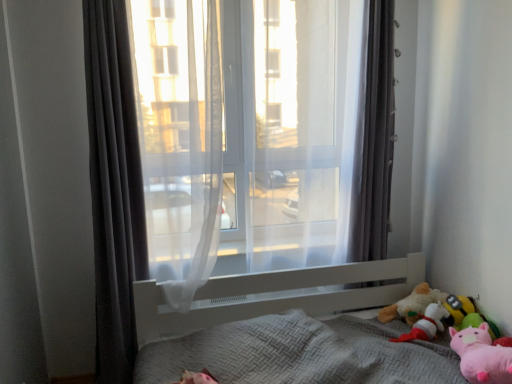
Question: Is dark gray fabric curtain at left, placed as the 2th curtain when sorted from right to left, far from fluffy plush toy at lower right, placed as the fourth toy when sorted from front to back?

Choices:
 (A) no
 (B) yes

Answer: (B)

Question: From a real-world perspective, is dark gray fabric curtain at left, the first curtain from the left, below fluffy plush toy at lower right, placed as the fourth toy when sorted from front to back?

Choices:
 (A) yes
 (B) no

Answer: (B)

Question: Is dark gray fabric curtain at left, the first curtain from the left, not inside fluffy plush toy at lower right, which is the first toy from back to front?

Choices:
 (A) no
 (B) yes

Answer: (B)

Question: Is dark gray fabric curtain at left, the first curtain from the left, to the left of fluffy plush toy at lower right, which is the first toy from back to front, from the viewer's perspective?

Choices:
 (A) yes
 (B) no

Answer: (A)

Question: Considering the relative sizes of dark gray fabric curtain at left, the first curtain from the left, and fluffy plush toy at lower right, placed as the fourth toy when sorted from front to back, in the image provided, is dark gray fabric curtain at left, the first curtain from the left, shorter than fluffy plush toy at lower right, placed as the fourth toy when sorted from front to back,?

Choices:
 (A) no
 (B) yes

Answer: (A)

Question: From their relative heights in the image, would you say pink plush toy at lower right is taller or shorter than fluffy plush toy at lower right, which is the first toy from back to front?

Choices:
 (A) tall
 (B) short

Answer: (B)

Question: From a real-world perspective, is pink plush toy at lower right above or below fluffy plush toy at lower right, placed as the fourth toy when sorted from front to back?

Choices:
 (A) below
 (B) above

Answer: (A)

Question: Considering the relative positions of pink plush toy at lower right and fluffy plush toy at lower right, placed as the fourth toy when sorted from front to back, in the image provided, is pink plush toy at lower right to the left or to the right of fluffy plush toy at lower right, placed as the fourth toy when sorted from front to back,?

Choices:
 (A) left
 (B) right

Answer: (B)

Question: Is pink plush toy at lower right wider or thinner than fluffy plush toy at lower right, placed as the fourth toy when sorted from front to back?

Choices:
 (A) wide
 (B) thin

Answer: (B)

Question: Looking at their shapes, would you say pink plush toy at lower right, the fourth toy when ordered from back to front, is wider or thinner than translucent fabric at center?

Choices:
 (A) wide
 (B) thin

Answer: (B)

Question: From a real-world perspective, is pink plush toy at lower right, the fourth toy when ordered from back to front, above or below translucent fabric at center?

Choices:
 (A) above
 (B) below

Answer: (B)

Question: From their relative heights in the image, would you say pink plush toy at lower right, the fourth toy when ordered from back to front, is taller or shorter than translucent fabric at center?

Choices:
 (A) short
 (B) tall

Answer: (A)

Question: In the image, is pink plush toy at lower right, the fourth toy when ordered from back to front, positioned in front of or behind translucent fabric at center?

Choices:
 (A) front
 (B) behind

Answer: (A)

Question: Looking at the image, does textured gray bed at lower right seem bigger or smaller compared to fluffy plush toy at lower right, which is the first toy from back to front?

Choices:
 (A) small
 (B) big

Answer: (B)

Question: Considering the positions of point (360, 291) and point (392, 309), is point (360, 291) closer or farther from the camera than point (392, 309)?

Choices:
 (A) closer
 (B) farther

Answer: (B)